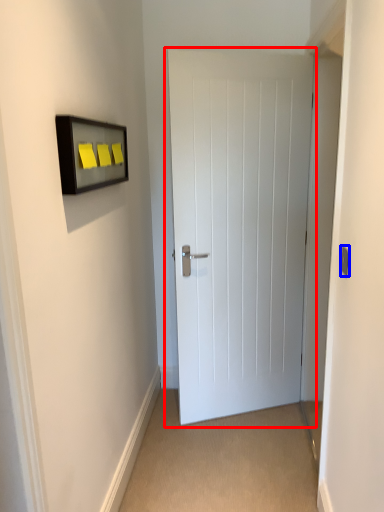
Question: Which point is closer to the camera, door (highlighted by a red box) or light switch (highlighted by a blue box)?

Choices:
 (A) door
 (B) light switch

Answer: (B)